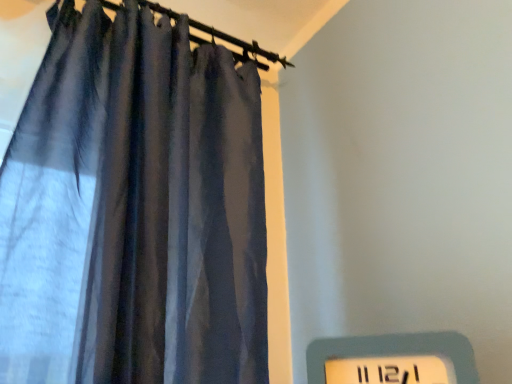
This screenshot has height=384, width=512. What do you see at coordinates (392, 356) in the screenshot? I see `white plastic electric outlet at lower right` at bounding box center [392, 356].

Find the location of `white plastic electric outlet at lower right`. white plastic electric outlet at lower right is located at coordinates (392, 356).

This screenshot has height=384, width=512. In order to click on white plastic electric outlet at lower right in this screenshot , I will do `click(392, 356)`.